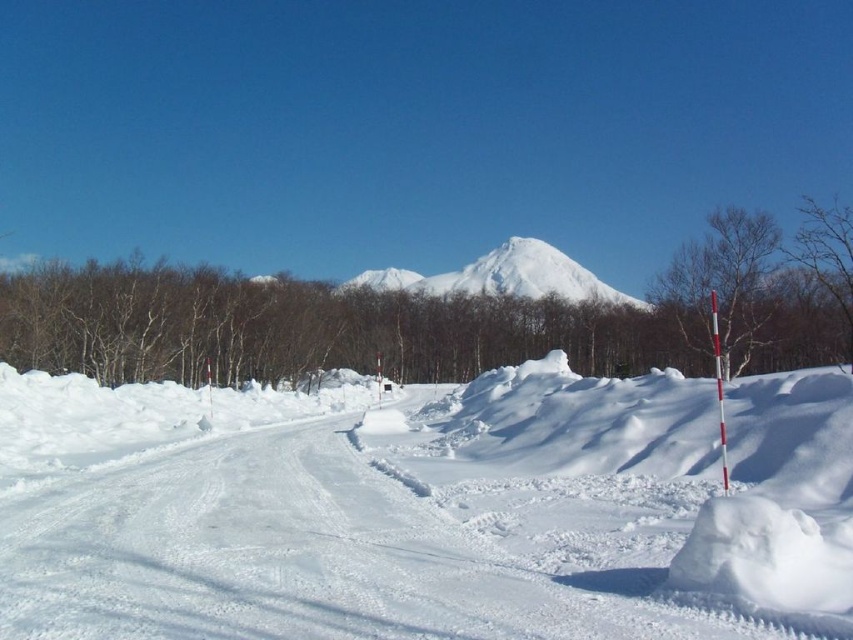
Question: Can you confirm if white snow at center is positioned above bare wood tree at right?

Choices:
 (A) yes
 (B) no

Answer: (B)

Question: In this image, where is white snow-covered mountain at center located relative to bare branches at upper right?

Choices:
 (A) above
 (B) below

Answer: (B)

Question: Can you confirm if white snow-covered mountain at center is bigger than bare branches at upper right?

Choices:
 (A) yes
 (B) no

Answer: (B)

Question: Which of the following is the closest to the observer?

Choices:
 (A) bare wood tree at right
 (B) white snow-covered mountain at center

Answer: (A)

Question: Among these points, which one is farthest from the camera?

Choices:
 (A) (405, 458)
 (B) (664, 285)
 (C) (788, 256)
 (D) (572, 294)

Answer: (D)

Question: Which of the following is the farthest from the observer?

Choices:
 (A) white snow-covered mountain at center
 (B) white snow at center

Answer: (A)